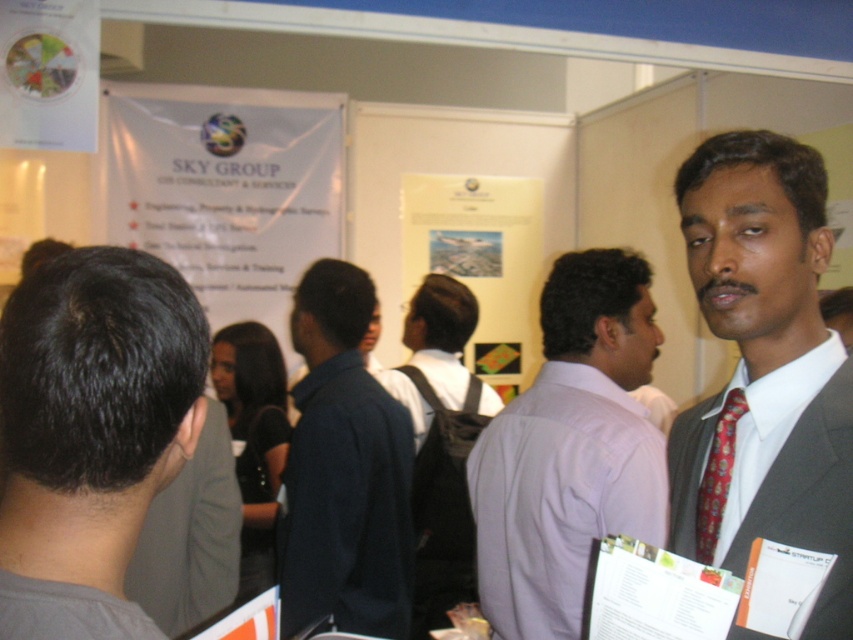
Between white shirt at center and white paper at upper center, which one is positioned higher?

white paper at upper center is above.

Where is `white shirt at center`? Image resolution: width=853 pixels, height=640 pixels. white shirt at center is located at coordinates (570, 449).

Does white paper at upper center appear on the right side of dark blue shirt at center?

No, white paper at upper center is not to the right of dark blue shirt at center.

Which is behind, point (326, 163) or point (387, 472)?

Point (326, 163)

At what (x,y) coordinates should I click in order to perform the action: click on white paper at upper center. Please return your answer as a coordinate pair (x, y). This screenshot has height=640, width=853. Looking at the image, I should click on (227, 192).

Who is more distant from viewer, [492,586] or [735,397]?

The point [492,586] is behind.

Does white shirt at center come behind red silk tie at right?

That is True.

Find the location of a particular element. The image size is (853, 640). white shirt at center is located at coordinates (570, 449).